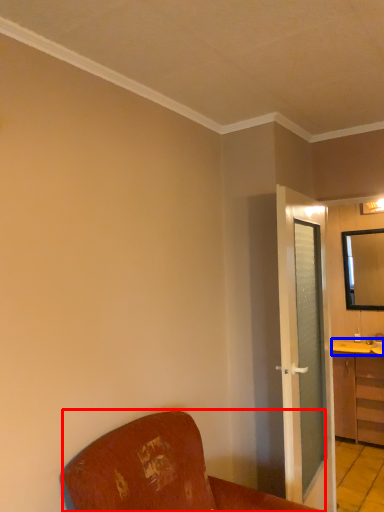
Question: Which object is closer to the camera taking this photo, furniture (highlighted by a red box) or counter top (highlighted by a blue box)?

Choices:
 (A) furniture
 (B) counter top

Answer: (A)